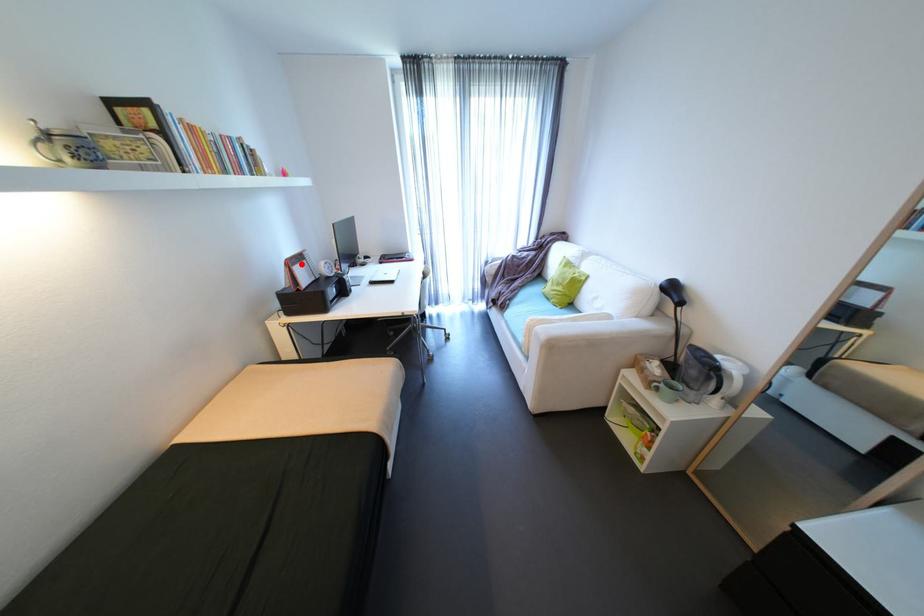
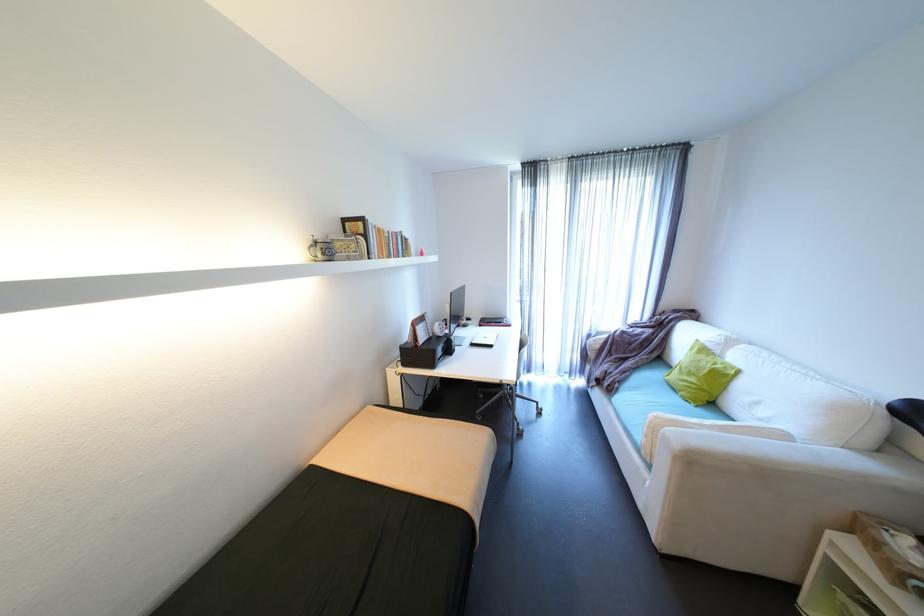
The point at the highlighted location is marked in the first image. Where is the corresponding point in the second image?

(426, 323)